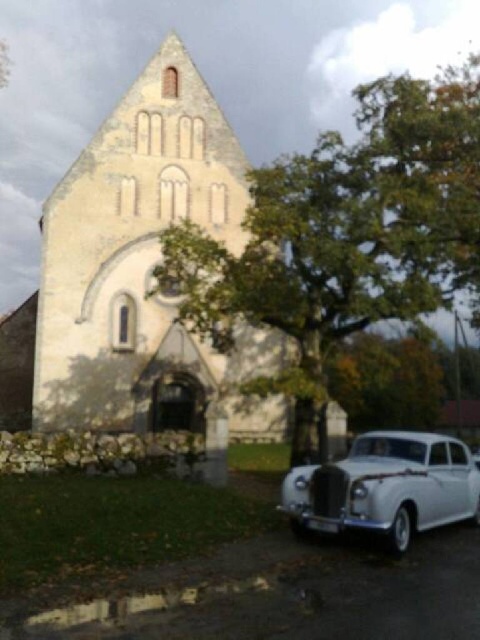
You are standing at the entrance of the church and want to take a photo of the light beige stone church at center. Where should you position yourself to capture the church in the frame?

To capture the light beige stone church at center in the frame, position yourself at the entrance and aim your camera towards the coordinates point (x=139, y=259) where the church is located.

You are standing in front of the light beige stone church at center and want to take a photo of the green leafy tree at center. Since the tree is partially blocking your view of the church, can you still see the church in the background?

The green leafy tree at center is located above the light beige stone church at center, so the tree is positioned higher up. This means the lower part of the church should still be visible behind the tree.